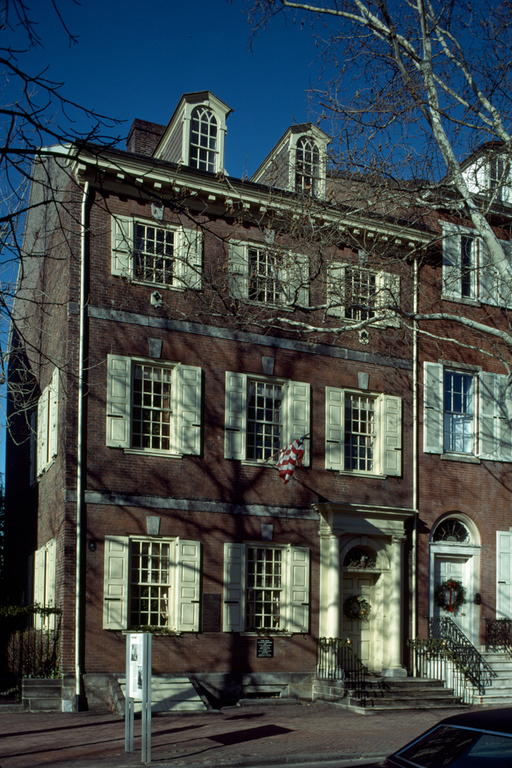
The image size is (512, 768). Identify the location of ceiling. (401, 180), (64, 146).